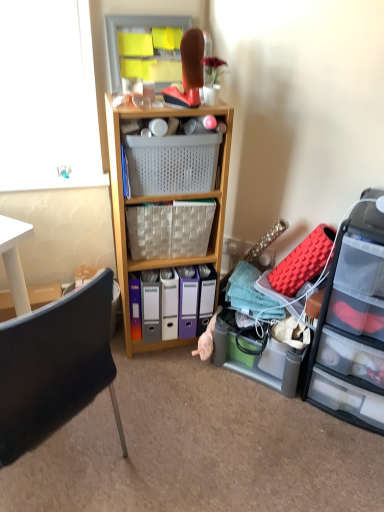
Identify the location of vacant region in front of clear plastic drawers at right. (335, 462).